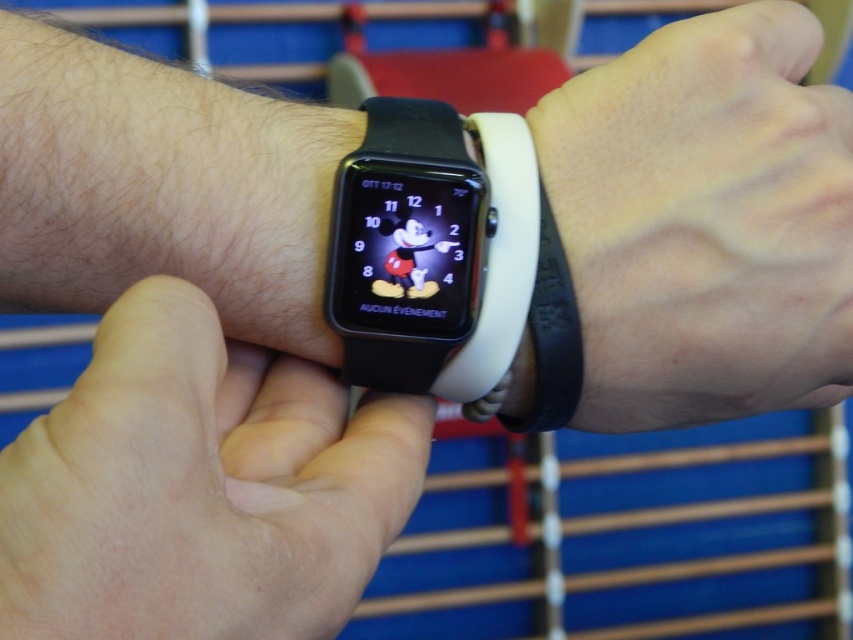
Can you confirm if black matte wristband at lower right is positioned to the left of white rubber band at center?

No, black matte wristband at lower right is not to the left of white rubber band at center.

Between black matte wristband at lower right and white rubber band at center, which one is positioned lower?

white rubber band at center

Between point (645, 256) and point (570, 404), which one is positioned behind?

Positioned behind is point (570, 404).

Identify the location of black matte wristband at lower right. This screenshot has height=640, width=853. (705, 221).

Does black rubber watch at center appear over white rubber band at center?

Yes.

Can you confirm if black rubber watch at center is wider than white rubber band at center?

Correct, the width of black rubber watch at center exceeds that of white rubber band at center.

This screenshot has width=853, height=640. Describe the element at coordinates (432, 250) in the screenshot. I see `black rubber watch at center` at that location.

Identify the location of black rubber watch at center. (432, 250).

Consider the image. Which is above, skinny white wristband at center or black matte wristband at lower right?

Positioned higher is black matte wristband at lower right.

The width and height of the screenshot is (853, 640). What are the coordinates of `skinny white wristband at center` in the screenshot? It's located at (200, 486).

You are a GUI agent. You are given a task and a screenshot of the screen. Output one action in this format:
    pyautogui.click(x=<x>, y=<y>)
    Task: Click on the skinny white wristband at center
    
    Given the screenshot: What is the action you would take?
    pyautogui.click(x=200, y=486)